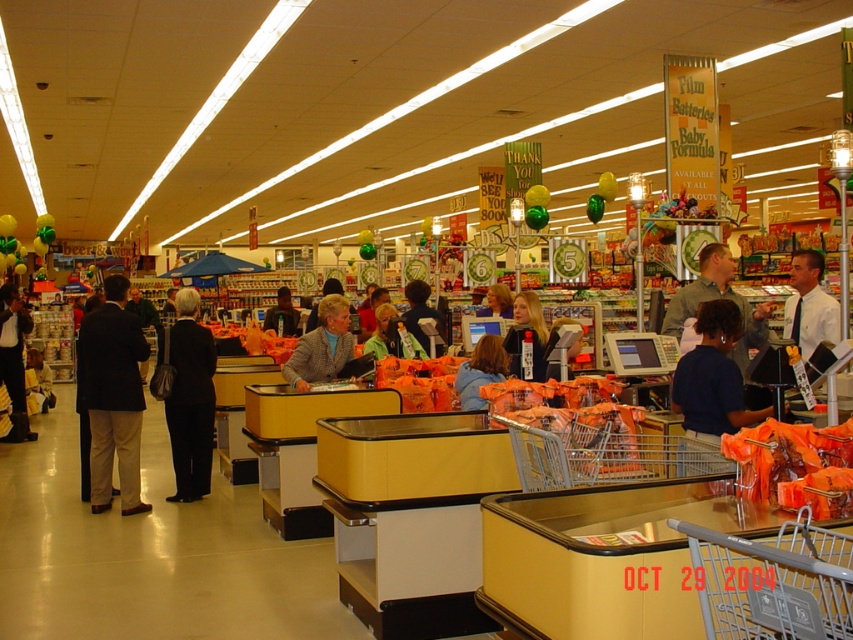
Is black fabric coat at center to the left of black leather jacket at left from the viewer's perspective?

In fact, black fabric coat at center is to the right of black leather jacket at left.

Is point (198, 323) behind point (9, 353)?

That is False.

The width and height of the screenshot is (853, 640). I want to click on black fabric coat at center, so click(x=189, y=397).

Is dark brown suit at left positioned before black leather jacket at left?

Yes, dark brown suit at left is in front of black leather jacket at left.

Which is behind, point (102, 492) or point (22, 376)?

The point (22, 376) is more distant.

Does point (102, 429) lie in front of point (0, 372)?

Yes, point (102, 429) is closer to viewer.

Locate an element on the screen. dark brown suit at left is located at coordinates (112, 396).

Which is in front, point (772, 627) or point (498, 300)?

Point (772, 627) is more forward.

Does point (706, 564) come closer to viewer compared to point (480, 312)?

That is True.

Find the location of a particular element. Image resolution: width=853 pixels, height=640 pixels. gray plastic shopping cart at lower right is located at coordinates (772, 580).